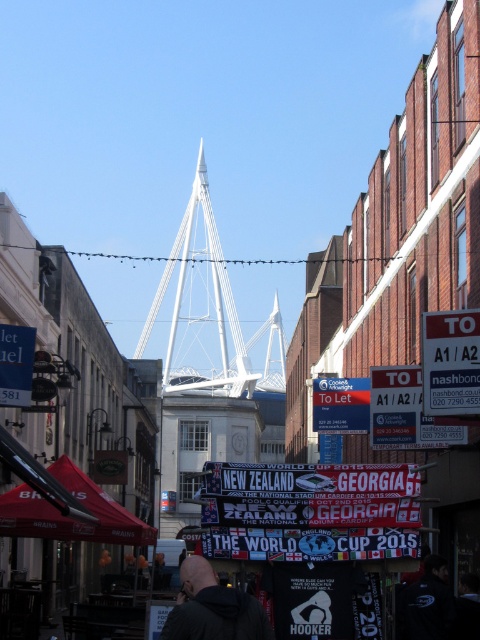
Question: Among these points, which one is nearest to the camera?

Choices:
 (A) (432, 611)
 (B) (206, 598)
 (C) (356, 432)

Answer: (B)

Question: Which object appears farthest from the camera in this image?

Choices:
 (A) dark gray jacket at lower center
 (B) white plastic sign at upper right
 (C) black fabric person at lower right
 (D) black fabric jacket at lower right

Answer: (B)

Question: Which point is closer to the camera?

Choices:
 (A) (453, 616)
 (B) (421, 321)
 (C) (459, 616)

Answer: (A)

Question: Can you confirm if white plastic sign at upper right is positioned to the left of blue plastic sign at center?

Choices:
 (A) no
 (B) yes

Answer: (A)

Question: Does black fabric jacket at lower right have a greater width compared to blue plastic sign at center?

Choices:
 (A) yes
 (B) no

Answer: (B)

Question: Is dark gray jacket at lower center below blue plastic sign at center?

Choices:
 (A) yes
 (B) no

Answer: (A)